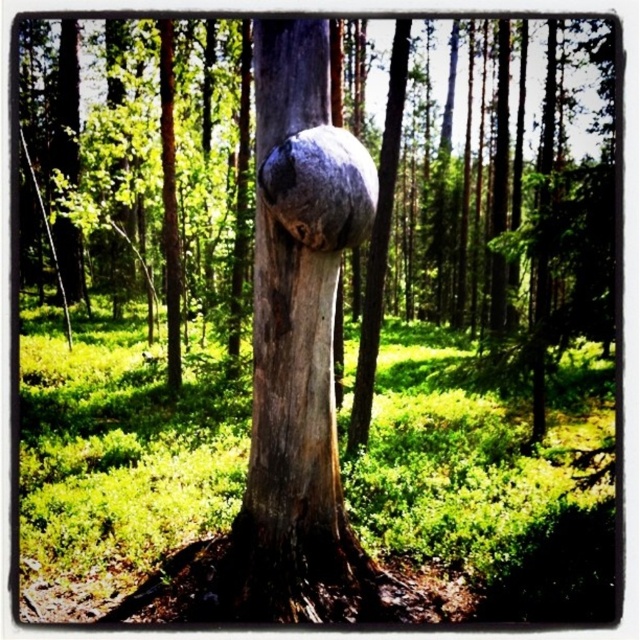
Question: Is smooth bark tree trunk at center smaller than gray rough stone at center?

Choices:
 (A) yes
 (B) no

Answer: (B)

Question: Considering the relative positions of smooth bark tree trunk at center and smooth gray bark at center in the image provided, where is smooth bark tree trunk at center located with respect to smooth gray bark at center?

Choices:
 (A) above
 (B) below

Answer: (A)

Question: Considering the real-world distances, which object is closest to the smooth gray bark at center?

Choices:
 (A) gray rough stone at center
 (B) smooth bark tree trunk at center

Answer: (A)

Question: Based on their relative distances, which object is nearer to the smooth bark tree trunk at center?

Choices:
 (A) gray rough stone at center
 (B) smooth gray bark at center

Answer: (B)

Question: Is smooth gray bark at center smaller than gray rough stone at center?

Choices:
 (A) yes
 (B) no

Answer: (B)

Question: Which point is closer to the camera?

Choices:
 (A) (131, 193)
 (B) (365, 237)
 (C) (300, 420)

Answer: (B)